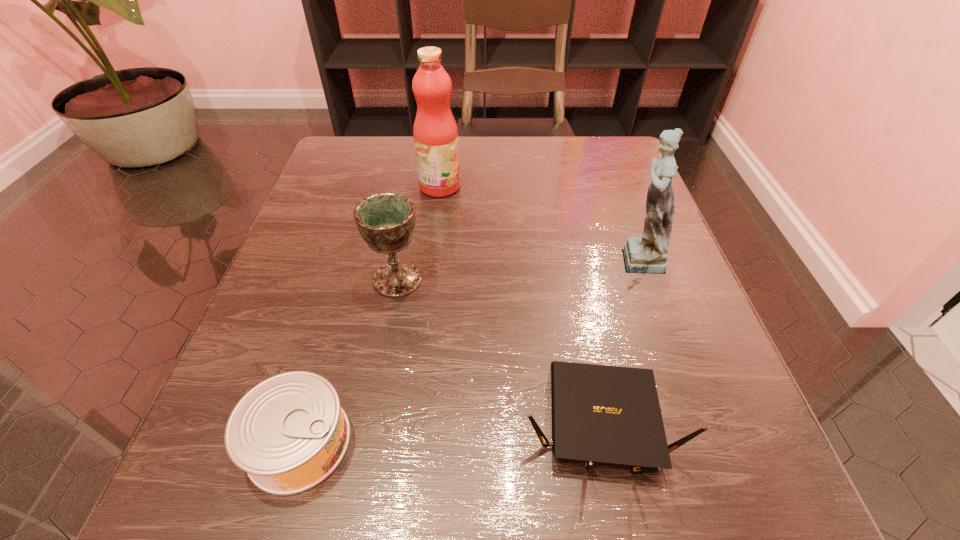
At what (x,y) coordinates should I click in order to perform the action: click on empty space between the shortest object and the figurine. Please return your answer as a coordinate pair (x, y). This screenshot has height=540, width=960. Looking at the image, I should click on (468, 350).

Locate an element on the screen. The image size is (960, 540). vacant area between the third tallest object and the shortest object is located at coordinates (348, 361).

At what (x,y) coordinates should I click in order to perform the action: click on free space between the third shortest object and the figurine. Please return your answer as a coordinate pair (x, y). Looking at the image, I should click on (516, 268).

Where is `vacant area that lies between the third shortest object and the figurine`? vacant area that lies between the third shortest object and the figurine is located at coordinates (516, 268).

This screenshot has width=960, height=540. What are the coordinates of `free area in between the can and the figurine` in the screenshot? It's located at click(x=468, y=350).

Locate an element on the screen. This screenshot has height=540, width=960. empty space between the third tallest object and the figurine is located at coordinates (516, 268).

The image size is (960, 540). What are the coordinates of `unoccupied position between the figurine and the fourth tallest object` in the screenshot? It's located at (616, 340).

I want to click on the closest object to the third tallest object, so click(289, 433).

I want to click on the third closest object relative to the router, so click(289, 433).

At what (x,y) coordinates should I click in order to perform the action: click on blank space that satisfies the following two spatial constraints: 1. on the front label of the fruit juice; 2. on the left side of the router. Please return your answer as a coordinate pair (x, y). Looking at the image, I should click on (414, 423).